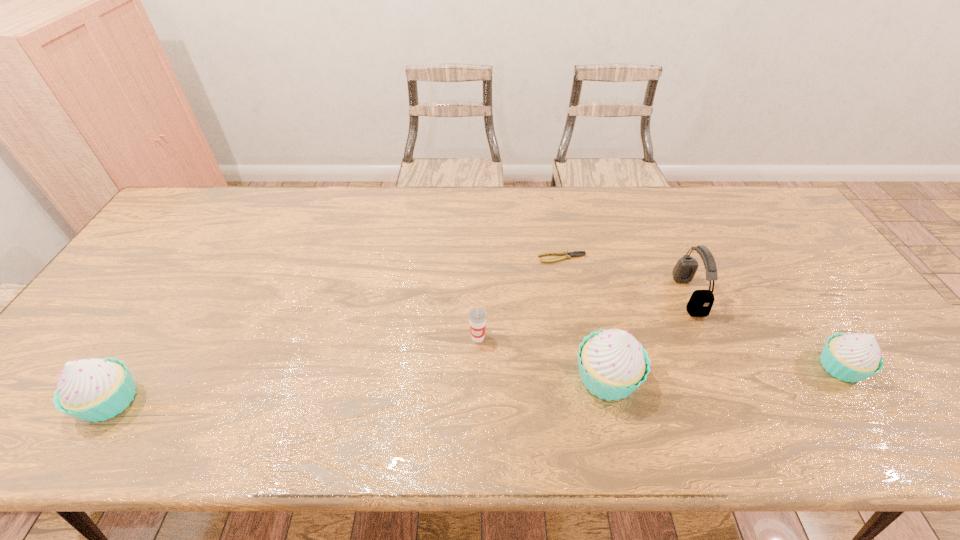
Select which cupcake is the third closest to the farthest object. Please provide its 2D coordinates. Your answer should be formatted as a tuple, i.e. [(x, y)], where the tuple contains the x and y coordinates of a point satisfying the conditions above.

[(92, 389)]

Where is `blank area in the image that satisfies the following two spatial constraints: 1. on the back side of the rightmost object; 2. on the left side of the second tallest cupcake`? Image resolution: width=960 pixels, height=540 pixels. blank area in the image that satisfies the following two spatial constraints: 1. on the back side of the rightmost object; 2. on the left side of the second tallest cupcake is located at coordinates (132, 367).

I want to click on vacant region that satisfies the following two spatial constraints: 1. on the headband of the fifth object from left to right; 2. on the side of the fourth nearest object with the logo, so click(707, 338).

What are the coordinates of `vacant space that satisfies the following two spatial constraints: 1. on the headband of the headset; 2. on the front side of the second cupcake from left to right` in the screenshot? It's located at (724, 377).

Locate an element on the screen. This screenshot has width=960, height=540. blank space that satisfies the following two spatial constraints: 1. on the headband of the second farthest object; 2. on the side of the fourth nearest object with the logo is located at coordinates (707, 338).

At what (x,y) coordinates should I click in order to perform the action: click on vacant point that satisfies the following two spatial constraints: 1. on the back side of the leftmost cupcake; 2. on the right side of the second cupcake from left to right. Please return your answer as a coordinate pair (x, y). Image resolution: width=960 pixels, height=540 pixels. Looking at the image, I should click on (125, 377).

Identify the location of vacant area in the image that satisfies the following two spatial constraints: 1. on the headband of the headset; 2. on the front side of the second cupcake from left to right. The height and width of the screenshot is (540, 960). (724, 377).

Where is `free point that satisfies the following two spatial constraints: 1. on the headband of the fifth object from left to right; 2. on the front side of the leftmost cupcake`? This screenshot has width=960, height=540. free point that satisfies the following two spatial constraints: 1. on the headband of the fifth object from left to right; 2. on the front side of the leftmost cupcake is located at coordinates (734, 401).

Find the location of `free spot that satisfies the following two spatial constraints: 1. on the side of the fifth object from right to left with the logo; 2. on the left side of the second cupcake from left to right`. free spot that satisfies the following two spatial constraints: 1. on the side of the fifth object from right to left with the logo; 2. on the left side of the second cupcake from left to right is located at coordinates (478, 377).

The width and height of the screenshot is (960, 540). Find the location of `blank space that satisfies the following two spatial constraints: 1. on the side of the fourth nearest object with the logo; 2. on the left side of the shortest cupcake`. blank space that satisfies the following two spatial constraints: 1. on the side of the fourth nearest object with the logo; 2. on the left side of the shortest cupcake is located at coordinates (478, 367).